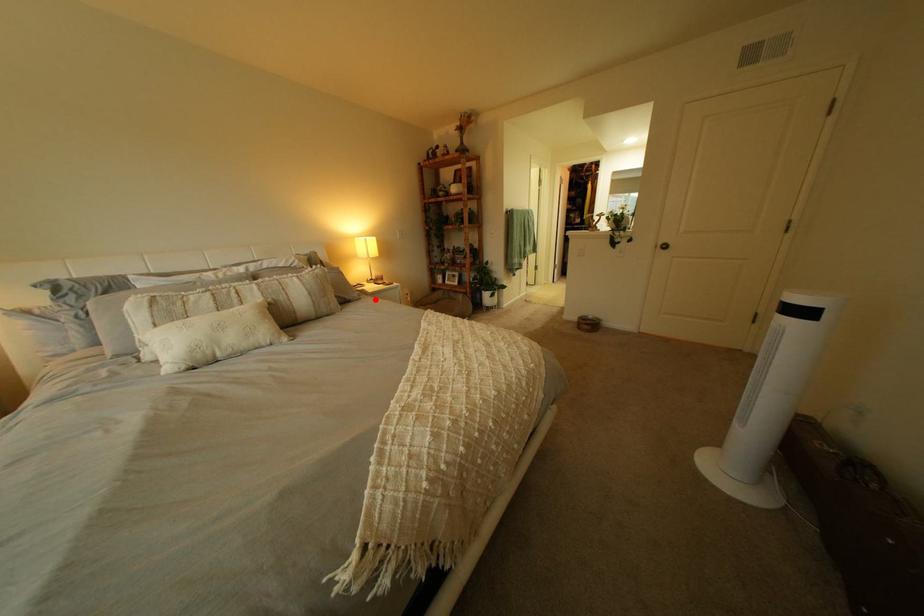
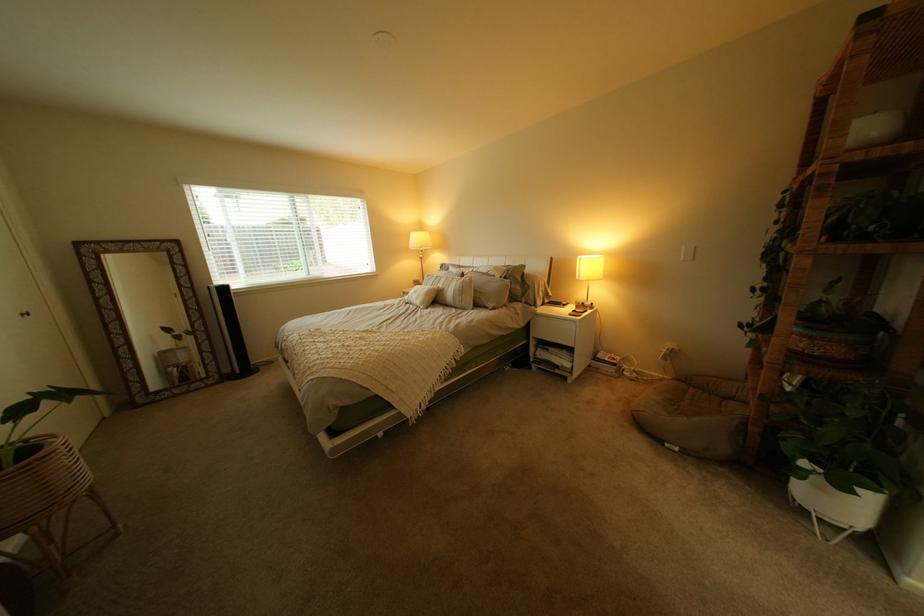
Locate, in the second image, the point that corresponds to the highlighted location in the first image.

(509, 310)